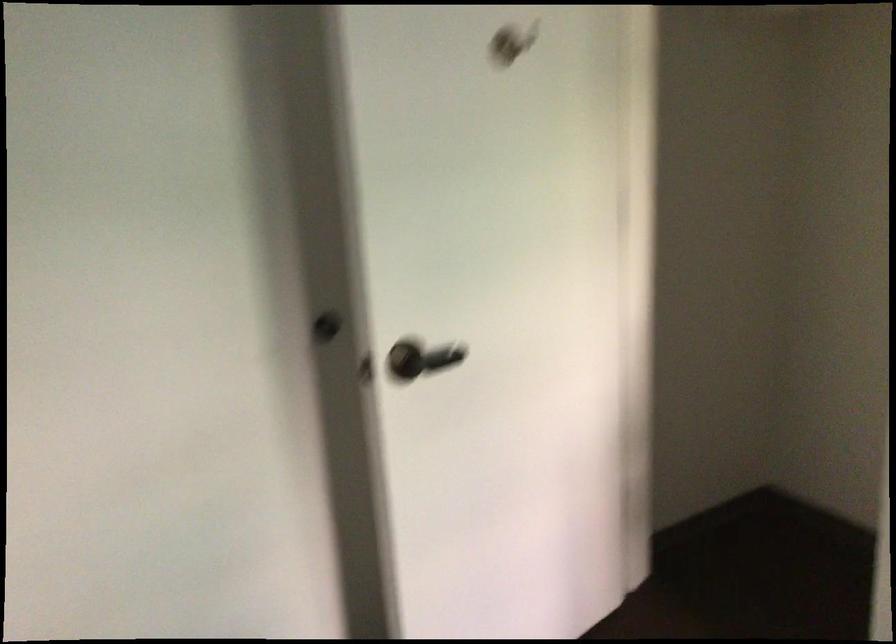
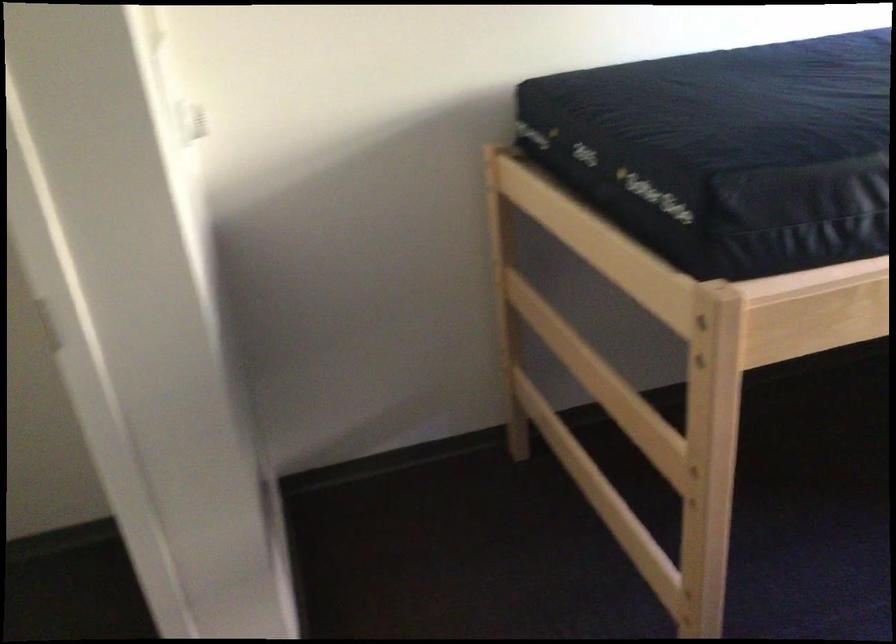
The first image is from the beginning of the video and the second image is from the end. How did the camera likely rotate when shooting the video?

The camera's rotation is toward right-down.